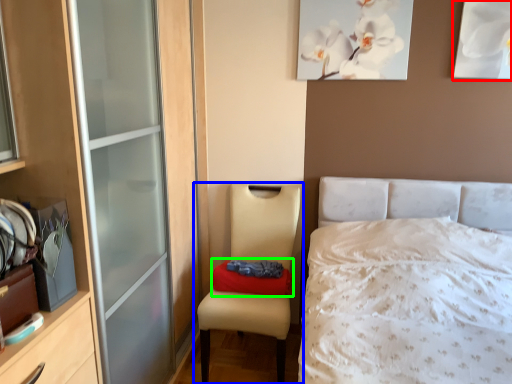
Question: Based on their relative distances, which object is nearer to picture frame (highlighted by a red box)? Choose from chair (highlighted by a blue box) and pillow (highlighted by a green box).

Choices:
 (A) chair
 (B) pillow

Answer: (A)